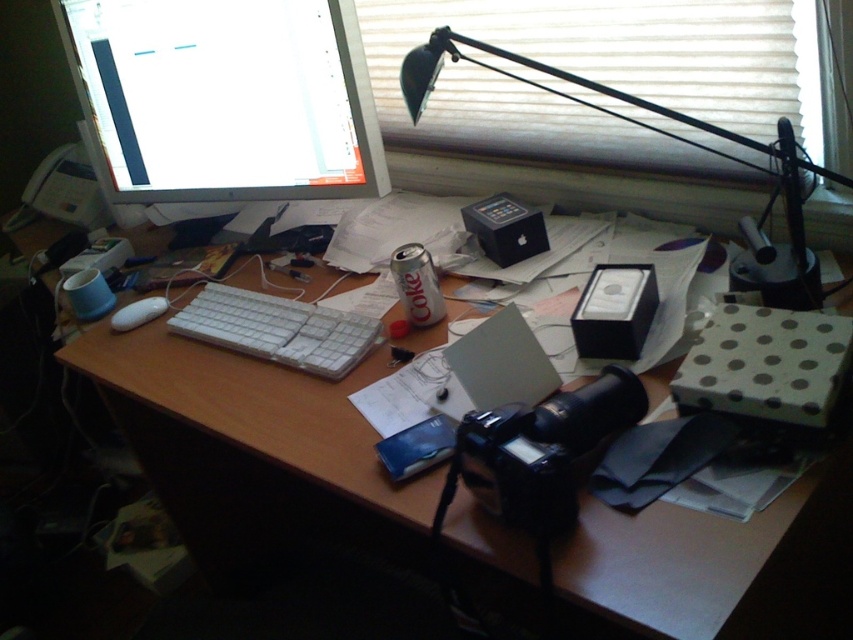
Can you confirm if matte white monitor at upper left is positioned to the left of white plastic keyboard at center?

Yes, matte white monitor at upper left is to the left of white plastic keyboard at center.

Which is behind, point (315, 13) or point (265, 301)?

The point (265, 301) is behind.

The image size is (853, 640). I want to click on matte white monitor at upper left, so click(x=223, y=100).

Locate an element on the screen. This screenshot has width=853, height=640. matte white monitor at upper left is located at coordinates (223, 100).

Identify the location of wooden desk at center. (252, 451).

Can you confirm if wooden desk at center is bigger than black metal desk lamp at upper right?

Yes, wooden desk at center is bigger than black metal desk lamp at upper right.

The width and height of the screenshot is (853, 640). What do you see at coordinates (252, 451) in the screenshot?
I see `wooden desk at center` at bounding box center [252, 451].

I want to click on wooden desk at center, so click(252, 451).

Which is in front, point (163, 84) or point (763, 172)?

Point (763, 172) is in front.

Between matte white monitor at upper left and black metal desk lamp at upper right, which one has less height?

matte white monitor at upper left

You are a GUI agent. You are given a task and a screenshot of the screen. Output one action in this format:
    pyautogui.click(x=<x>, y=<y>)
    Task: Click on the matte white monitor at upper left
    The image size is (853, 640).
    Given the screenshot: What is the action you would take?
    pyautogui.click(x=223, y=100)